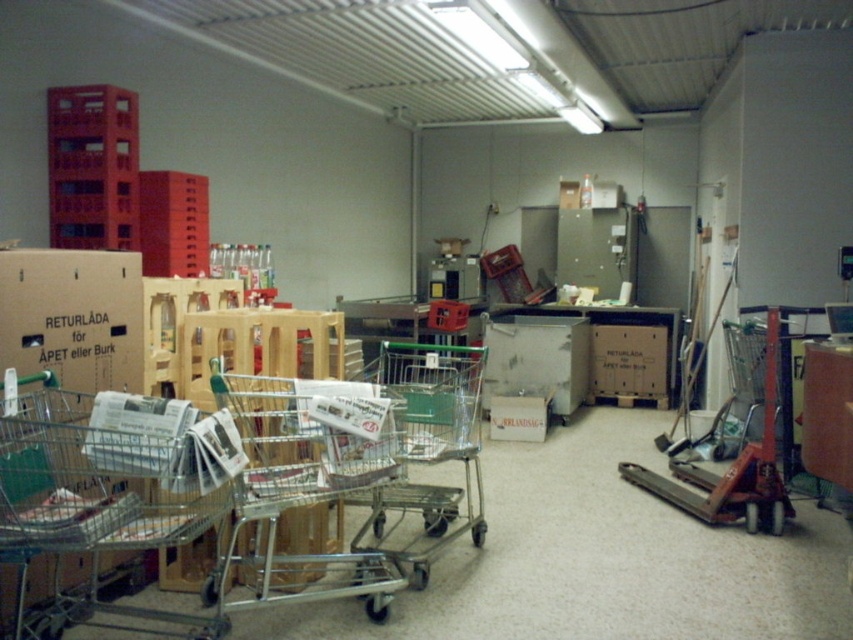
Is silver metallic shopping cart at center taller than orange metallic trolley at center right?

No, silver metallic shopping cart at center is not taller than orange metallic trolley at center right.

Locate an element on the screen. The image size is (853, 640). silver metallic shopping cart at center is located at coordinates (306, 483).

Who is more distant from viewer, (297,420) or (770,348)?

The point (770,348) is more distant.

This screenshot has width=853, height=640. I want to click on silver metallic shopping cart at center, so click(x=306, y=483).

Who is more forward, [335,388] or [392,497]?

Point [335,388]

Can you confirm if silver metallic shopping cart at center is shorter than green metallic shopping cart at center?

Incorrect, silver metallic shopping cart at center's height does not fall short of green metallic shopping cart at center's.

Locate an element on the screen. silver metallic shopping cart at center is located at coordinates (306, 483).

Between point (0, 403) and point (413, 460), which one is positioned behind?

Positioned behind is point (413, 460).

From the picture: Measure the distance between point (16, 620) and camera.

2.38 meters

At what (x,y) coordinates should I click in order to perform the action: click on metallic silver shopping cart at left. Please return your answer as a coordinate pair (x, y). Image resolution: width=853 pixels, height=640 pixels. Looking at the image, I should click on (102, 488).